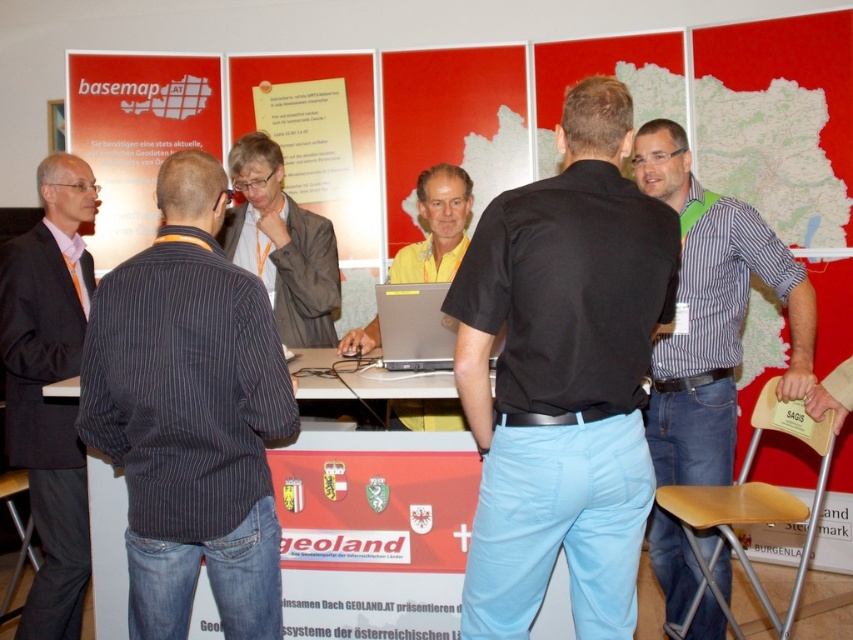
The width and height of the screenshot is (853, 640). Describe the element at coordinates (47, 384) in the screenshot. I see `orange tie at left` at that location.

Between point (91, 220) and point (431, 408), which one is positioned in front?

Positioned in front is point (91, 220).

Where is `orange tie at left`? orange tie at left is located at coordinates (47, 384).

Who is lower down, black cotton shirt at center or white paper at center?

Positioned lower is black cotton shirt at center.

Who is more forward, (550, 532) or (374, 104)?

Point (550, 532)

Locate an element on the screen. black cotton shirt at center is located at coordinates (563, 376).

Consider the image. Does matte paper poster at upper left have a larger size compared to silver metallic laptop at center?

Indeed, matte paper poster at upper left has a larger size compared to silver metallic laptop at center.

Between matte paper poster at upper left and silver metallic laptop at center, which one is positioned higher?

matte paper poster at upper left

Where is `matte paper poster at upper left`? matte paper poster at upper left is located at coordinates (137, 132).